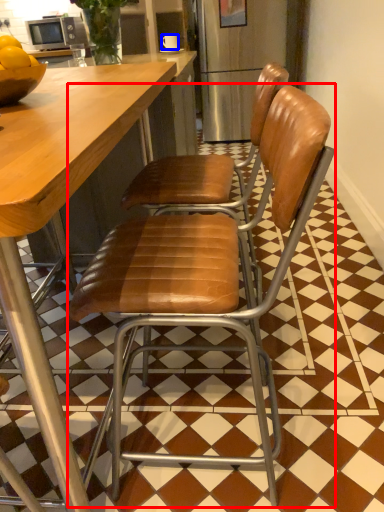
Question: Which point is further to the camera, chair (highlighted by a red box) or coffee cup (highlighted by a blue box)?

Choices:
 (A) chair
 (B) coffee cup

Answer: (B)